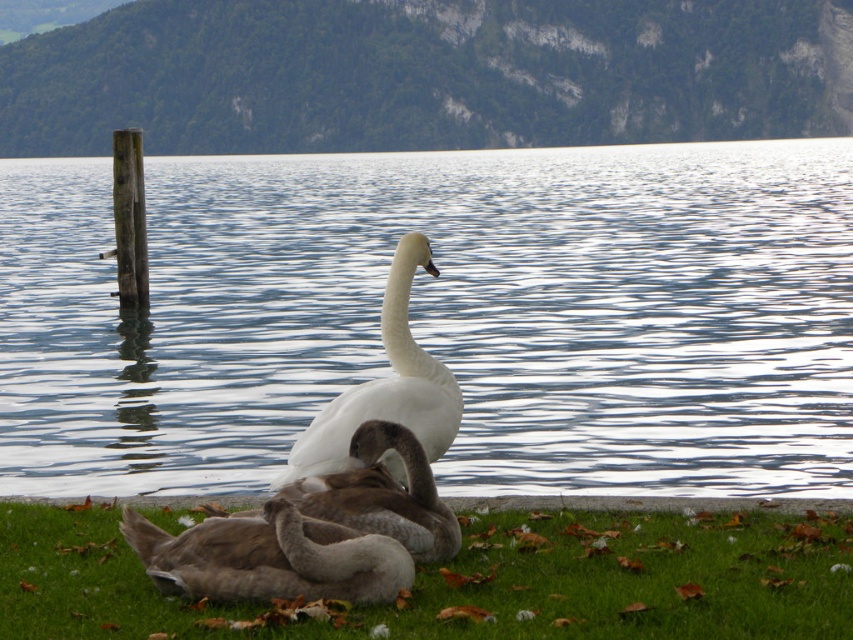
You are a photographer positioned at the edge of the lake. You want to capture a photo of the white glossy swan at center without the brown soft grass at lower center appearing in the foreground. Is this possible based on their positions?

The brown soft grass at lower center is in front of the white glossy swan at center, so it will block the view. To avoid the grass in the foreground, you need to adjust your position or angle to ensure the swan is not obscured.